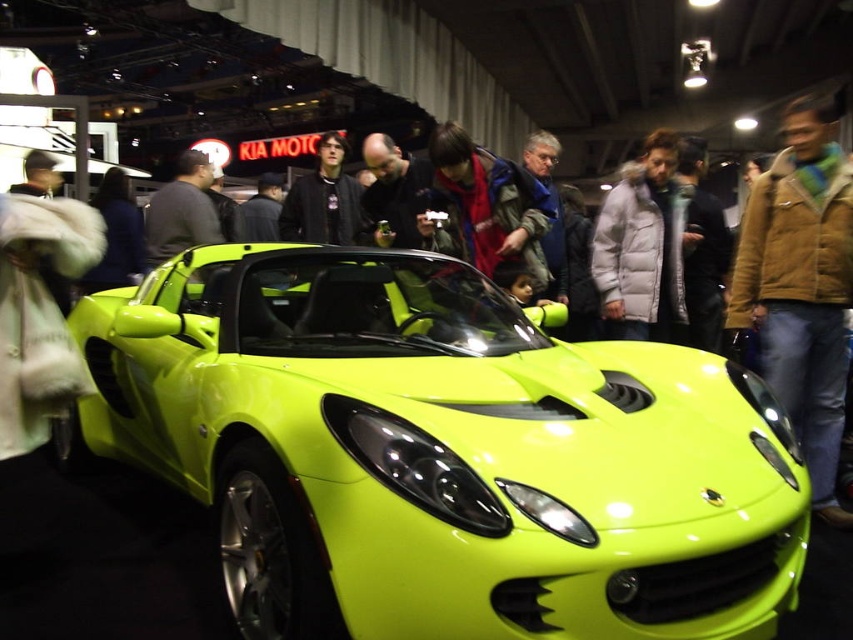
You are organizing a photo shoot and need to place two items in the scene for a closeup. The items are the brown leather jacket at right and the dark gray sweater at center. Which item should you choose if you want the one that takes up more horizontal space?

The brown leather jacket at right should be chosen because its width surpasses that of the dark gray sweater at center, making it the wider option between the two.

You are standing at the auto show and want to take a photo of the lime green matte sports car at center. If your camera has a minimum focusing distance of 5 feet, will you be able to take a clear photo without moving closer?

The distance between you and the lime green matte sports car at center is 5.31 feet, which is just above the camera minimum focusing distance of 5 feet. Therefore, you can take a clear photo without moving closer.